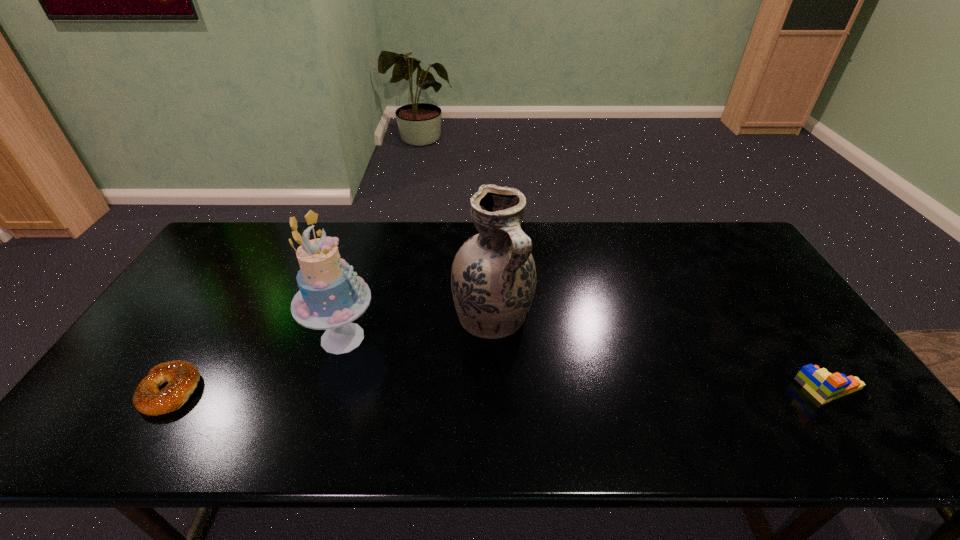
This screenshot has width=960, height=540. I want to click on free space on the desktop that is between the bagel and the rightmost object and is positioned with a ladder on the side of the cake, so click(442, 390).

Locate an element on the screen. free spot on the desktop that is between the leftmost object and the Lego and is positioned with the handle on the side of the vase is located at coordinates (553, 389).